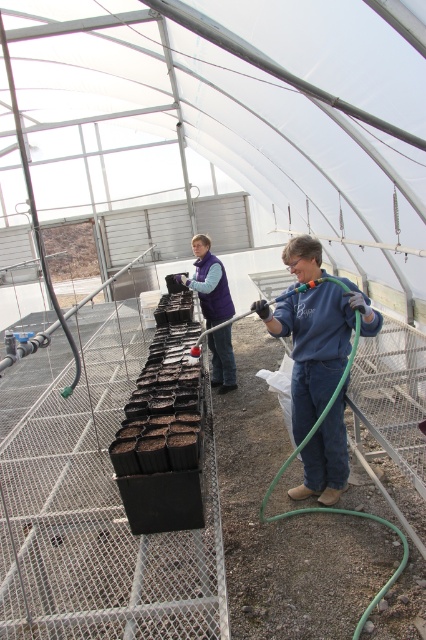
How distant is blue fleece jacket at right from purple fleece vest at center?

7.75 feet

Between blue fleece jacket at right and purple fleece vest at center, which one has less height?

purple fleece vest at center is shorter.

Identify the location of blue fleece jacket at right. This screenshot has height=640, width=426. (317, 342).

This screenshot has width=426, height=640. Identify the location of blue fleece jacket at right. (317, 342).